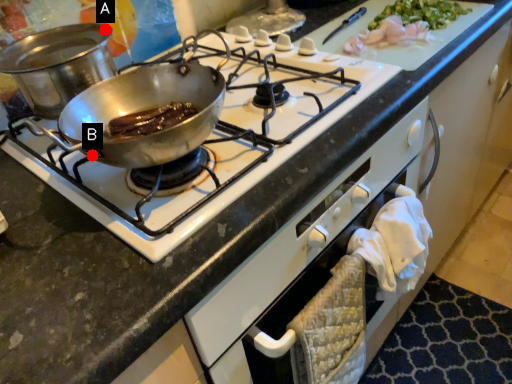
Question: Two points are circled on the image, labeled by A and B beside each circle. Which point appears farthest from the camera in this image?

Choices:
 (A) A is further
 (B) B is further

Answer: (A)